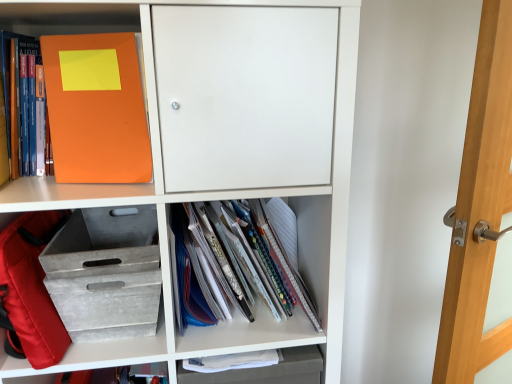
Question: Is orange matte folder at upper left, arranged as the second shelf when ordered from the bottom, taller than orange matte folder at upper left, marked as the first book in a top-to-bottom arrangement?

Choices:
 (A) no
 (B) yes

Answer: (B)

Question: Does orange matte folder at upper left, placed as the second shelf when sorted from top to bottom, have a lesser width compared to orange matte folder at upper left, marked as the first book in a top-to-bottom arrangement?

Choices:
 (A) no
 (B) yes

Answer: (A)

Question: Is orange matte folder at upper left, arranged as the second shelf when ordered from the bottom, positioned far away from orange matte folder at upper left, marked as the first book in a top-to-bottom arrangement?

Choices:
 (A) no
 (B) yes

Answer: (A)

Question: Can you confirm if orange matte folder at upper left, placed as the second shelf when sorted from top to bottom, is shorter than orange matte folder at upper left, placed as the second book when sorted from right to left?

Choices:
 (A) yes
 (B) no

Answer: (B)

Question: Does orange matte folder at upper left, arranged as the second shelf when ordered from the bottom, appear on the left side of orange matte folder at upper left, marked as the 2th book in a bottom-to-top arrangement?

Choices:
 (A) no
 (B) yes

Answer: (A)

Question: Is red fabric backpack at lower left in front of or behind gray textured crate at lower left, arranged as the 3th shelf when viewed from the top, in the image?

Choices:
 (A) behind
 (B) front

Answer: (B)

Question: Looking at the image, does red fabric backpack at lower left seem bigger or smaller compared to gray textured crate at lower left, arranged as the 3th shelf when viewed from the top?

Choices:
 (A) small
 (B) big

Answer: (A)

Question: Does point (59, 354) appear closer or farther from the camera than point (77, 342)?

Choices:
 (A) closer
 (B) farther

Answer: (A)

Question: Considering the positions of red fabric backpack at lower left and gray textured crate at lower left, acting as the 1th shelf starting from the bottom, in the image, is red fabric backpack at lower left taller or shorter than gray textured crate at lower left, acting as the 1th shelf starting from the bottom,?

Choices:
 (A) short
 (B) tall

Answer: (B)

Question: From their relative heights in the image, would you say white paper notebook at center, the 2th book when ordered from left to right, is taller or shorter than transparent glass door at right?

Choices:
 (A) tall
 (B) short

Answer: (B)

Question: From the image's perspective, is white paper notebook at center, which is the second book in top-to-bottom order, above or below transparent glass door at right?

Choices:
 (A) above
 (B) below

Answer: (A)

Question: From a real-world perspective, is white paper notebook at center, which is the 1th book in bottom-to-top order, positioned above or below transparent glass door at right?

Choices:
 (A) below
 (B) above

Answer: (B)

Question: Does point (262, 299) appear closer or farther from the camera than point (492, 61)?

Choices:
 (A) closer
 (B) farther

Answer: (B)

Question: Does point (119, 196) appear closer or farther from the camera than point (472, 170)?

Choices:
 (A) closer
 (B) farther

Answer: (A)

Question: Is orange matte folder at upper left, the first shelf when ordered from top to bottom, to the left or to the right of transparent glass door at right in the image?

Choices:
 (A) right
 (B) left

Answer: (B)